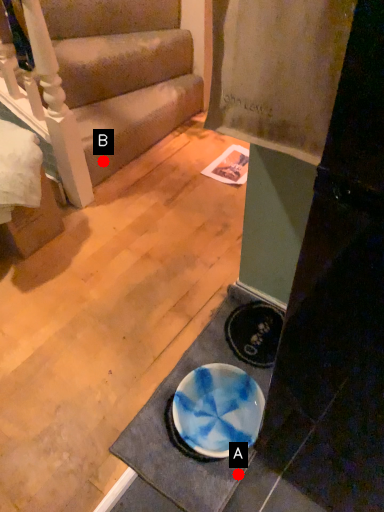
Question: Two points are circled on the image, labeled by A and B beside each circle. Which point is further to the camera?

Choices:
 (A) A is further
 (B) B is further

Answer: (B)